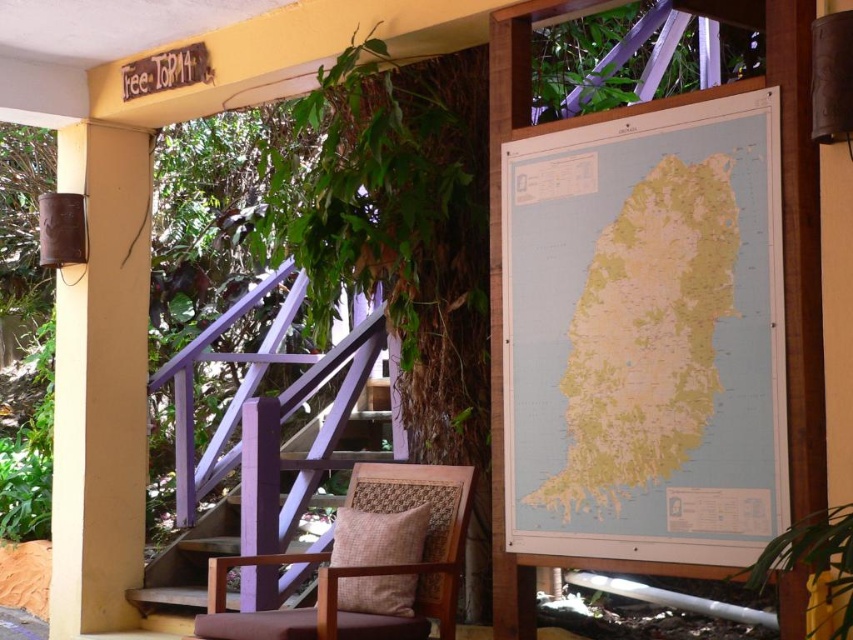
Image resolution: width=853 pixels, height=640 pixels. Find the location of `purple wood stairs at center`. purple wood stairs at center is located at coordinates (228, 524).

Is purple wood stairs at center smaller than brown woven armchair at center?

Incorrect, purple wood stairs at center is not smaller in size than brown woven armchair at center.

The height and width of the screenshot is (640, 853). Find the location of `purple wood stairs at center`. purple wood stairs at center is located at coordinates (228, 524).

The width and height of the screenshot is (853, 640). In order to click on purple wood stairs at center in this screenshot , I will do `click(228, 524)`.

Does light blue paper map at right appear under purple wood stairs at center?

No.

Who is taller, light blue paper map at right or purple wood stairs at center?

Standing taller between the two is light blue paper map at right.

This screenshot has width=853, height=640. Find the location of `light blue paper map at right`. light blue paper map at right is located at coordinates (645, 336).

The image size is (853, 640). What are the coordinates of `light blue paper map at right` in the screenshot? It's located at (645, 336).

Between light blue paper map at right and brown woven armchair at center, which one has more height?

light blue paper map at right

Is light blue paper map at right positioned at the back of brown woven armchair at center?

No.

This screenshot has height=640, width=853. What are the coordinates of `light blue paper map at right` in the screenshot? It's located at (645, 336).

At what (x,y) coordinates should I click in order to perform the action: click on light blue paper map at right. Please return your answer as a coordinate pair (x, y). This screenshot has height=640, width=853. Looking at the image, I should click on click(645, 336).